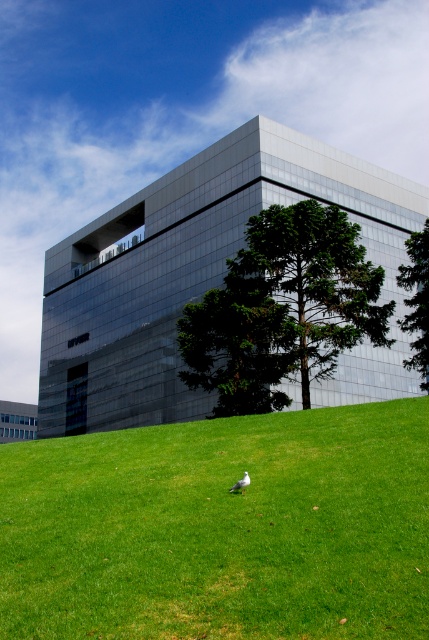
Question: Among these points, which one is farthest from the camera?

Choices:
 (A) (239, 481)
 (B) (159, 547)
 (C) (302, 228)

Answer: (C)

Question: Which object is closer to the camera taking this photo?

Choices:
 (A) green leafy tree at right
 (B) white matte bird at lower center
 (C) green grassy at lower center

Answer: (C)

Question: Is green grassy at lower center thinner than white matte bird at lower center?

Choices:
 (A) yes
 (B) no

Answer: (B)

Question: Is green leafy tree at center above white matte bird at lower center?

Choices:
 (A) no
 (B) yes

Answer: (B)

Question: Does green leafy tree at center have a larger size compared to green leafy tree at right?

Choices:
 (A) yes
 (B) no

Answer: (B)

Question: Which object is farther from the camera taking this photo?

Choices:
 (A) green leafy tree at center
 (B) green leafy tree at right
 (C) green grassy at lower center
 (D) white matte bird at lower center

Answer: (B)